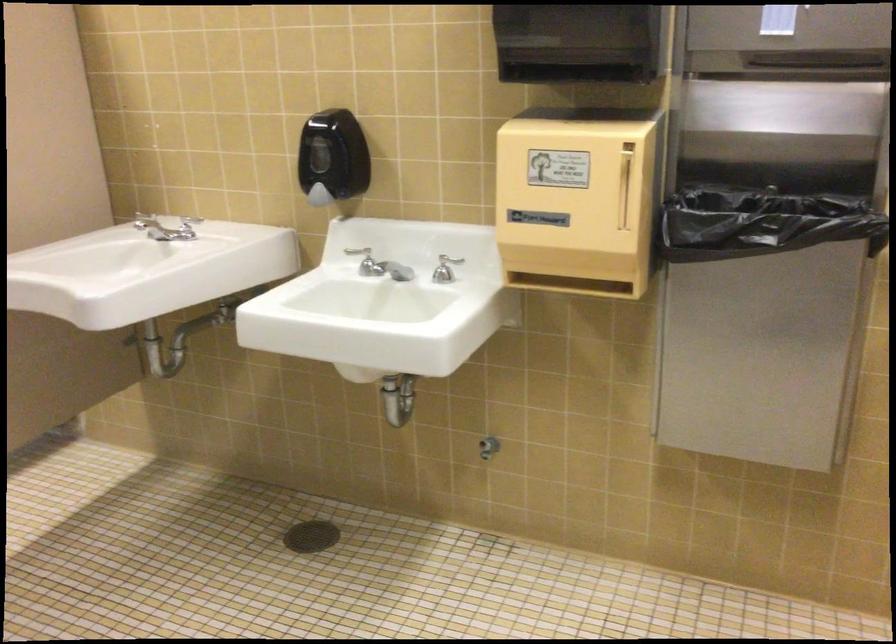
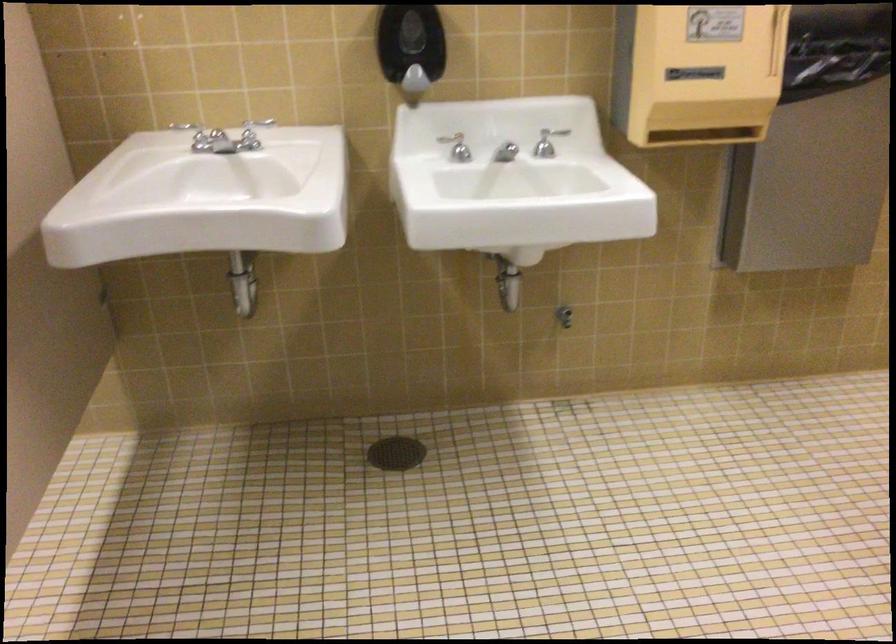
In the second image, find the point that corresponds to the point at 448,270 in the first image.

(547, 142)